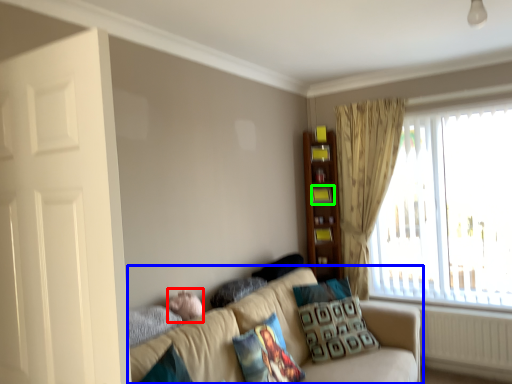
Question: Considering the real-world distances, which object is farthest from baby (highlighted by a red box)? studio couch (highlighted by a blue box) or shelf (highlighted by a green box)?

Choices:
 (A) studio couch
 (B) shelf

Answer: (B)